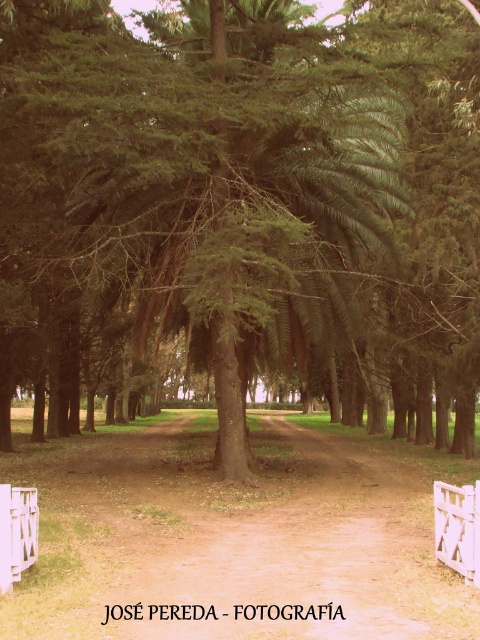
You are standing at the center of the pathway and see the white wooden fence at lower right and the white wooden fence at lower left. Which fence is located to the east side of the other?

The white wooden fence at lower right is positioned on the right side of the white wooden fence at lower left. Since the pathway is lined with trees on both sides and the scene is viewed from a central position, the white wooden fence at lower right would be to the east if the pathway is oriented north to south. However, without specific directional markers, we can only state their relative positions as described.

You are standing at the center of the pathway and notice two white wooden fences on either side. Which fence, the white wooden fence at lower right or the white wooden fence at lower left, is taller?

The white wooden fence at lower left is taller than the white wooden fence at lower right.